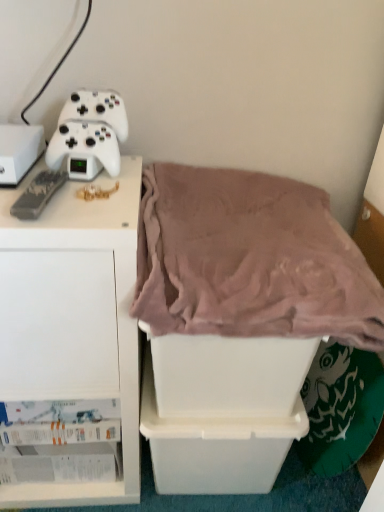
You are a GUI agent. You are given a task and a screenshot of the screen. Output one action in this format:
    pyautogui.click(x=<x>, y=<y>)
    Task: Click on the free space in front of white matte game controller at upper left, placed as the 1th game controller when sorted from top to bottom
    
    Given the screenshot: What is the action you would take?
    pyautogui.click(x=89, y=195)